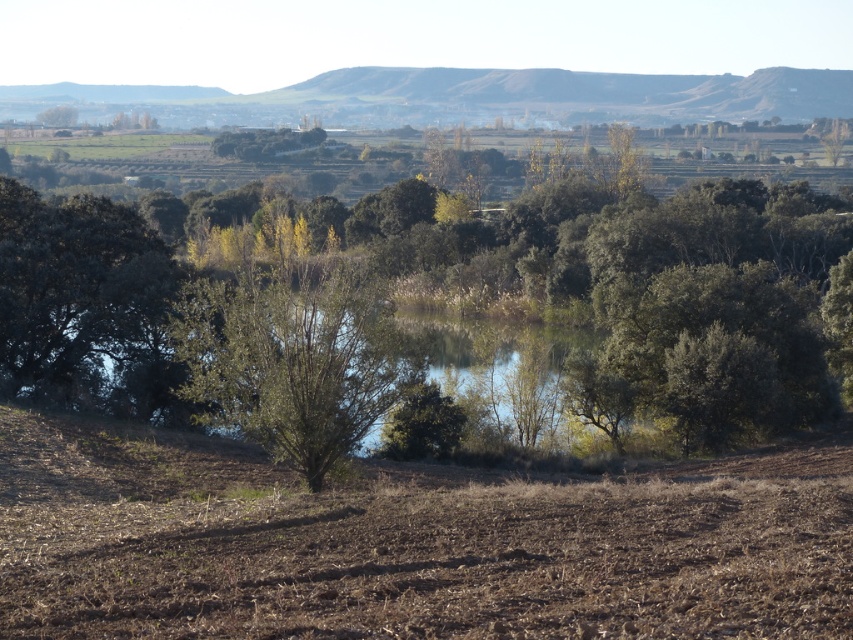
You are standing in the rural landscape and want to walk from the brown soil at lower center to the green leafy tree at upper left. Which direction should you head to move away from the viewer?

To move away from the viewer towards the green leafy tree at upper left, you should head away from the brown soil at lower center since it is closer to the viewer compared to the tree.